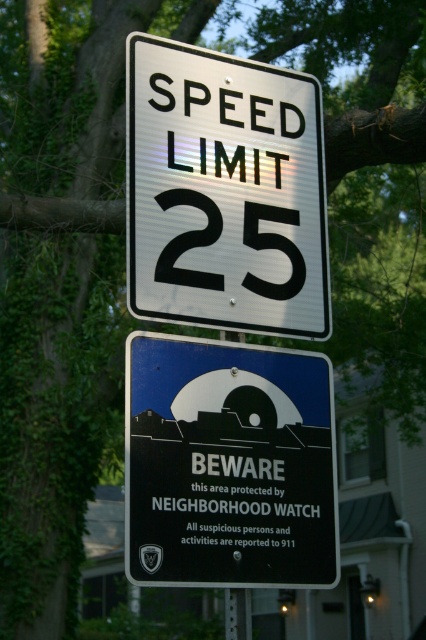
What is the significance of the point at coordinates (227, 465) in the image?

The point at coordinates (227, 465) indicates the location of the metallic blue sign at center, which serves as a warning about the neighborhood watch and emphasizes the speed limit restriction.

You are driving and notice two signs on a pole. The white metallic speed limit sign at upper center and the metallic blue sign at center. Which sign is closer to you?

The white metallic speed limit sign at upper center is closer to you because the metallic blue sign at center is behind it.

You are driving and see the white metallic speed limit sign at upper center and the metallic blue sign at center on a pole. Which sign should you look at first to know the speed limit?

The white metallic speed limit sign at upper center is located above the metallic blue sign at center, so you should look at the white metallic speed limit sign at upper center first to know the speed limit.